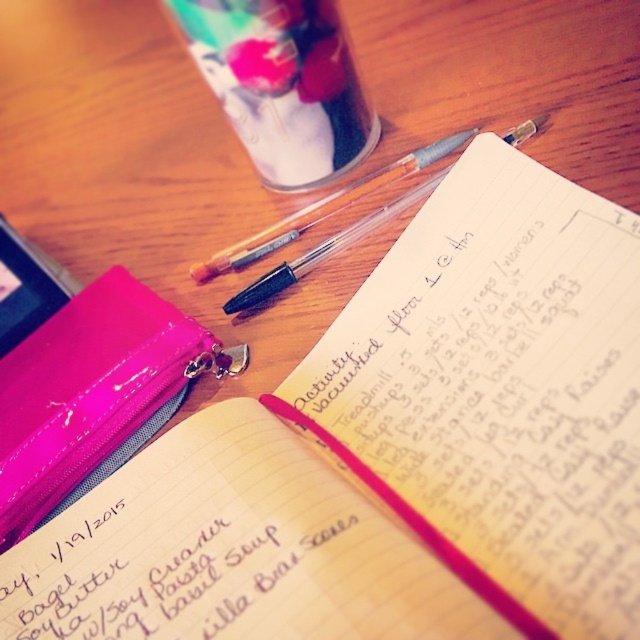
You are organizing your desk and need to locate the matte paper notebook at center. According to the coordinates provided, where exactly should you look on the desk?

The matte paper notebook at center is located at point coordinates of [180,570].

You are organizing items on your desk and need to place a new item between the matte paper notebook at center and the pink glossy binder at lower left. Which object should you place the new item closer to if you want it to be nearer to the viewer?

You should place the new item closer to the matte paper notebook at center because it is already closer to the viewer than the pink glossy binder at lower left.